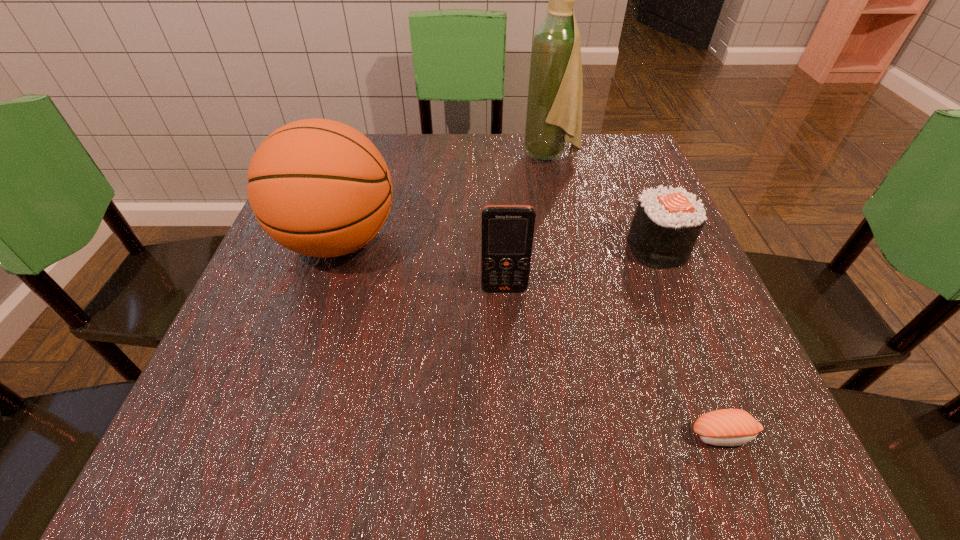
The width and height of the screenshot is (960, 540). I want to click on vacant space located 0.280m on the front-facing side of the third object from right to left, so [x=405, y=156].

At what (x,y) coordinates should I click in order to perform the action: click on free space located on the front-facing side of the third object from right to left. Please return your answer as a coordinate pair (x, y). This screenshot has width=960, height=540. Looking at the image, I should click on (388, 156).

This screenshot has height=540, width=960. Find the location of `vacant position located 0.110m on the front-facing side of the third object from right to left`. vacant position located 0.110m on the front-facing side of the third object from right to left is located at coordinates (477, 156).

Find the location of a particular element. Image resolution: width=960 pixels, height=540 pixels. free space located 0.090m on the right of the basketball is located at coordinates (447, 241).

I want to click on blank area located on the screen of the fourth object from right to left, so pyautogui.click(x=510, y=396).

Where is `free space located on the left of the taller sushi`? Image resolution: width=960 pixels, height=540 pixels. free space located on the left of the taller sushi is located at coordinates (574, 247).

At what (x,y) coordinates should I click in order to perform the action: click on vacant position located on the back of the shorter sushi. Please return your answer as a coordinate pair (x, y). Looking at the image, I should click on (697, 368).

Where is `object that is at the far edge`? This screenshot has width=960, height=540. object that is at the far edge is located at coordinates (555, 91).

Identify the location of object at the near edge. The image size is (960, 540). (726, 427).

I want to click on object that is at the left edge, so click(x=318, y=187).